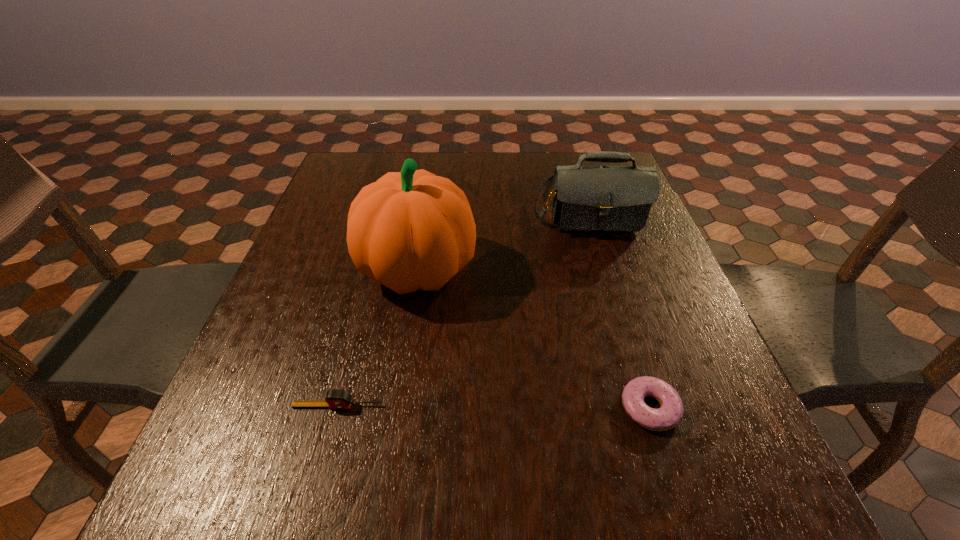
Find the location of `vacant area that lies between the shortest object and the tape measure`. vacant area that lies between the shortest object and the tape measure is located at coordinates (493, 407).

The width and height of the screenshot is (960, 540). What are the coordinates of `free area in between the shortest object and the third tallest object` in the screenshot? It's located at (493, 407).

Where is `empty space that is in between the tallest object and the shoulder bag`? This screenshot has height=540, width=960. empty space that is in between the tallest object and the shoulder bag is located at coordinates (501, 238).

The width and height of the screenshot is (960, 540). In order to click on empty space between the doughnut and the pumpkin in this screenshot , I will do `click(534, 339)`.

This screenshot has width=960, height=540. I want to click on free space between the shortest object and the second shortest object, so click(493, 407).

This screenshot has height=540, width=960. Identify the location of unoccupied area between the tape measure and the shortest object. (493, 407).

Locate an element on the screen. empty location between the doughnut and the shoulder bag is located at coordinates (617, 306).

At what (x,y) coordinates should I click in order to perform the action: click on blank region between the shoulder bag and the pumpkin. Please return your answer as a coordinate pair (x, y). Looking at the image, I should click on (501, 238).

What are the coordinates of `free space between the doughnut and the pumpkin` in the screenshot? It's located at (534, 339).

Identify the location of object that stands as the closest to the pumpkin. (584, 198).